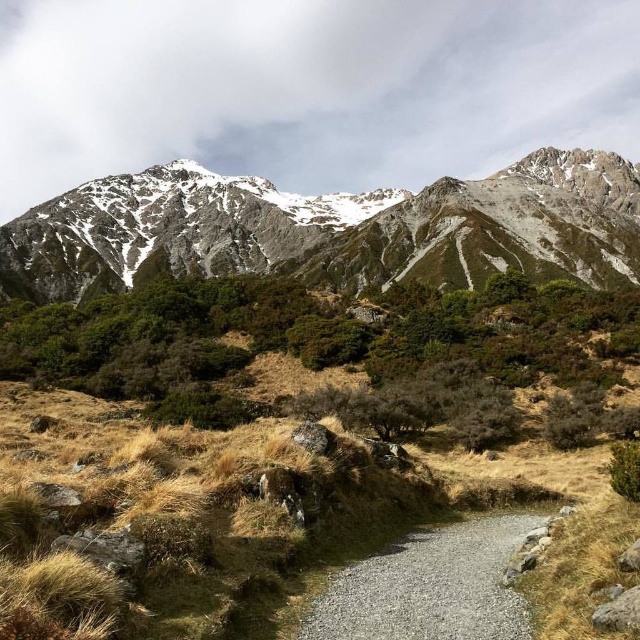
Question: Can you confirm if snowy granite mountain range at upper center is positioned to the left of gravelly path at center?

Choices:
 (A) no
 (B) yes

Answer: (A)

Question: Is snowy granite mountain range at upper center closer to the viewer compared to gravelly path at center?

Choices:
 (A) yes
 (B) no

Answer: (B)

Question: Which point appears closest to the camera in this image?

Choices:
 (A) (426, 556)
 (B) (193, 252)

Answer: (A)

Question: Does snowy granite mountain range at upper center appear on the left side of gravelly path at center?

Choices:
 (A) no
 (B) yes

Answer: (A)

Question: Which object is farther from the camera taking this photo?

Choices:
 (A) snowy granite mountain range at upper center
 (B) gravelly path at center

Answer: (A)